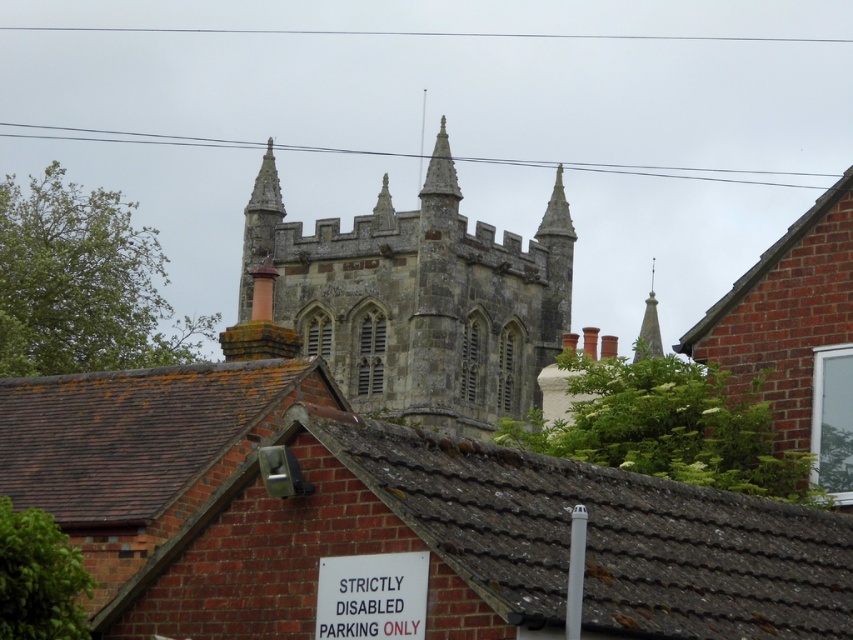
You are a tourist standing at the base of the stone gothic tower at center and want to reach the white plastic sign at lower center. Given that your average walking speed is 3 feet per second, how many seconds will it take you to reach the sign?

The distance between the stone gothic tower at center and the white plastic sign at lower center is 248.27 feet. At a walking speed of 3 feet per second, the time required is 248.27 divided by 3, which equals approximately 82.76 seconds. Therefore, it will take roughly 83 seconds to reach the sign.

You are a tourist standing in front of the stone gothic tower at center and the white plastic sign at lower center. Which object is closer to you?

The stone gothic tower at center is closer to you because the white plastic sign at lower center is behind it.

You are a tourist standing in front of the historic stone building. You notice the stone gothic tower at center and the white plastic sign at lower center. Which object is bigger in size?

The stone gothic tower at center is larger in size than the white plastic sign at lower center.